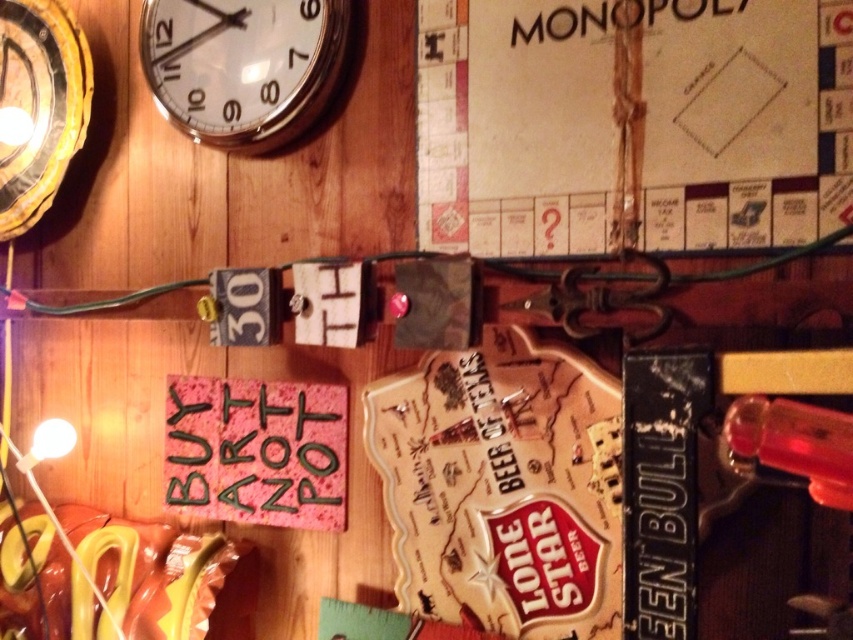
You are organizing a game night and need to place the wooden monopoly game at upper right and the white glossy clock at upper left on a shelf. If the shelf has limited space, which item should you move to ensure both fit?

You should move the wooden monopoly game at upper right to the right of the white glossy clock at upper left since it is already positioned to the right, allowing both items to fit on the shelf by maintaining their current arrangement.

You are organizing a game night and want to place a new board game box that is 15 cm wide between the wooden monopoly game at upper right and the white glossy clock at upper left. Can you fit it there based on their widths?

The wooden monopoly game at upper right is wider than the white glossy clock at upper left. Since the new board game box is 15 cm wide, it depends on the available space between them. However, without knowing the exact distance between the two objects, we cannot confirm if the 15 cm width will fit. Please measure the space between the wooden monopoly game at upper right and the white glossy clock at upper left first.

You are arranging items on a wooden table and want to place a new decorative item between the wooden monopoly game at upper right and the white glossy clock at upper left. The decorative item is 6 inches wide. Is there enough space between them to fit the item without moving either game or clock?

The distance between the wooden monopoly game at upper right and the white glossy clock at upper left is 12.68 inches. Since the decorative item is 6 inches wide, there is enough space to fit it between them without moving either the game or the clock.